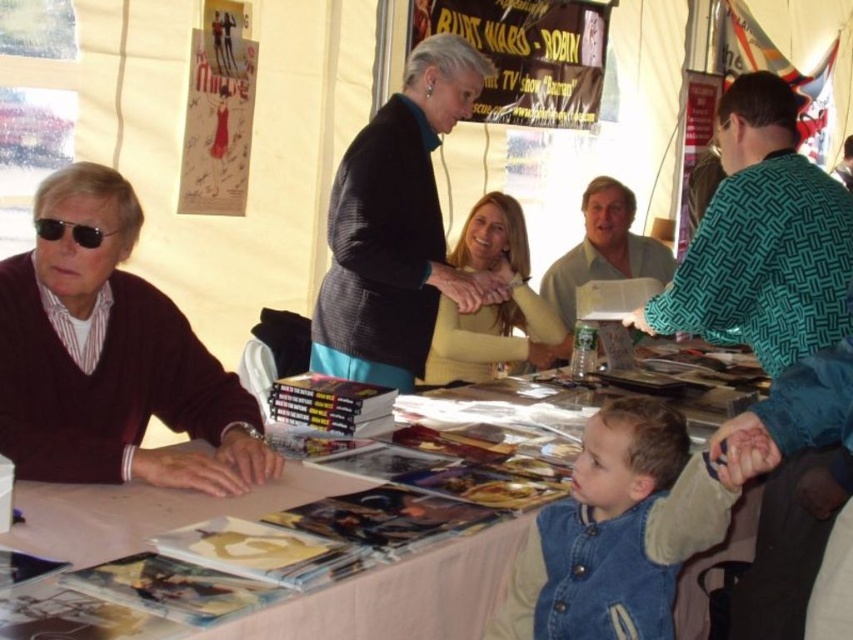
Question: Considering the real-world distances, which object is farthest from the green woven sweater at upper right?

Choices:
 (A) black textured sweater at center
 (B) denim jacket at lower right
 (C) light green shirt at center

Answer: (C)

Question: Observing the image, what is the correct spatial positioning of maroon sweater at left in reference to black textured sweater at center?

Choices:
 (A) below
 (B) above

Answer: (A)

Question: Is green woven sweater at upper right smaller than black textured sweater at center?

Choices:
 (A) yes
 (B) no

Answer: (B)

Question: Which object is positioned closest to the black plastic sunglasses at left?

Choices:
 (A) light green shirt at center
 (B) matte yellow sweater at center

Answer: (B)

Question: Can you confirm if white paper at center is smaller than light green shirt at center?

Choices:
 (A) no
 (B) yes

Answer: (B)

Question: Which point appears closest to the camera in this image?

Choices:
 (A) (498, 320)
 (B) (421, 298)

Answer: (B)